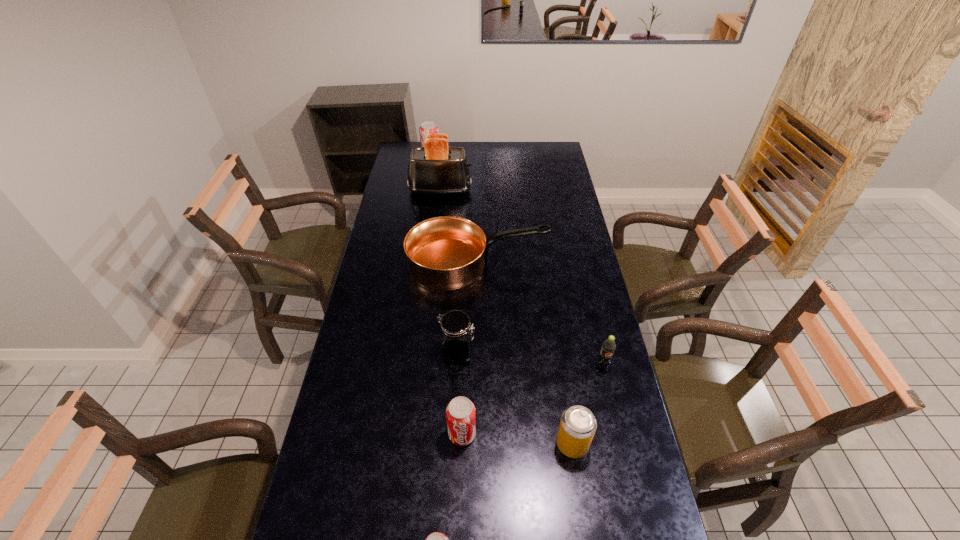
I want to click on the seventh nearest object, so click(x=435, y=169).

Where is `toaster`? The image size is (960, 540). toaster is located at coordinates (435, 169).

Image resolution: width=960 pixels, height=540 pixels. I want to click on the tallest soda can, so click(426, 127).

Find the location of `the farthest object`. the farthest object is located at coordinates (426, 127).

I want to click on frying pan, so [444, 253].

This screenshot has width=960, height=540. I want to click on jar, so click(456, 336).

At what (x,y) coordinates should I click in order to perform the action: click on the rightmost object. Please return your answer as a coordinate pair (x, y). Looking at the image, I should click on (608, 347).

Identify the location of green soda. The width and height of the screenshot is (960, 540). (608, 347).

Locate an element on the screen. the second smallest red soda can is located at coordinates (461, 415).

At what (x,y) coordinates should I click in order to perform the action: click on the second soda can from right to left. Please return your answer as a coordinate pair (x, y). Looking at the image, I should click on (578, 425).